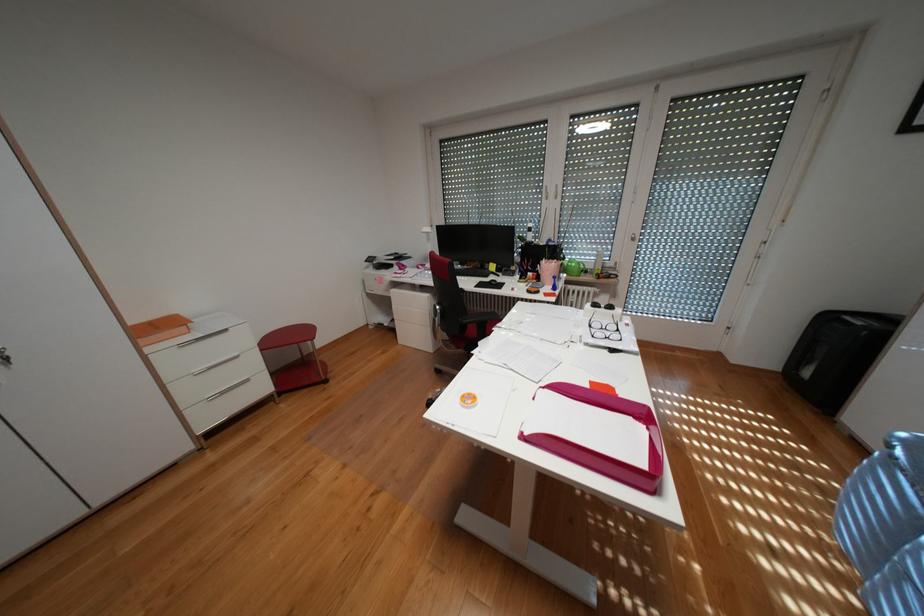
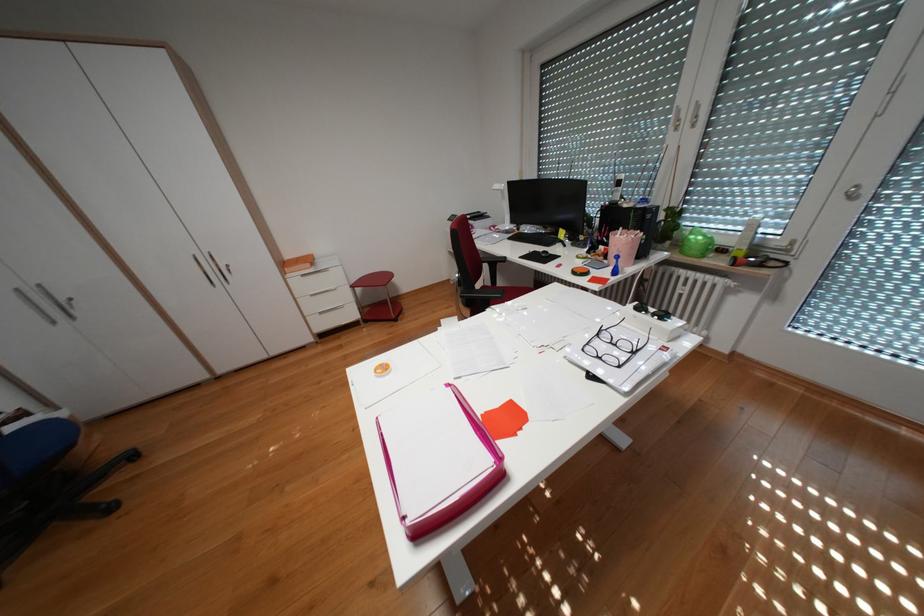
Find the pixel in the second image that matches point 492,282 in the first image.

(546, 252)